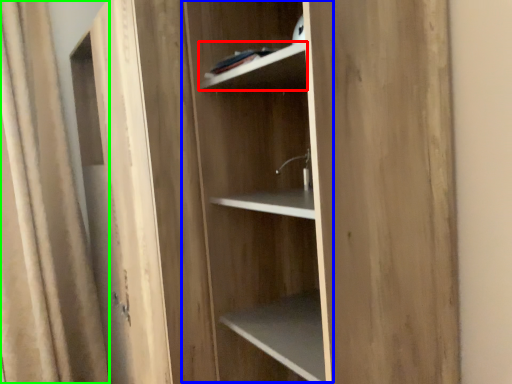
Question: Estimate the real-world distances between objects in this image. Which object is closer to cabinet (highlighted by a red box), cabinetry (highlighted by a blue box) or curtain (highlighted by a green box)?

Choices:
 (A) cabinetry
 (B) curtain

Answer: (A)